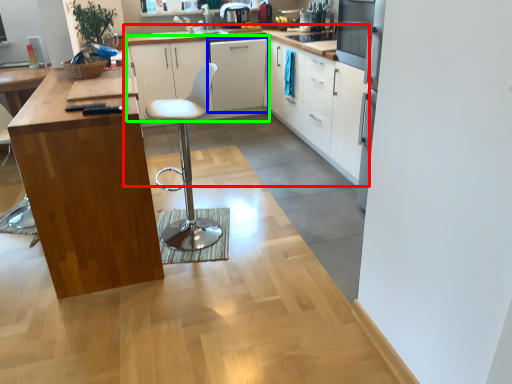
Question: Estimate the real-world distances between objects in this image. Which object is closer to cabinetry (highlighted by a red box), cabinetry (highlighted by a blue box) or cabinetry (highlighted by a green box)?

Choices:
 (A) cabinetry
 (B) cabinetry

Answer: (B)